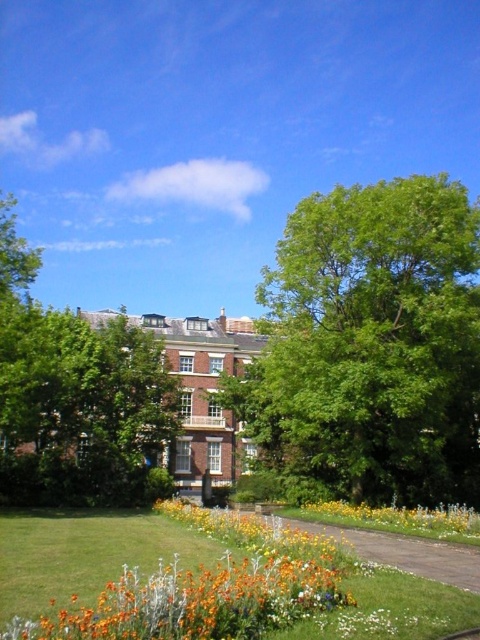
Question: Can you confirm if green leafy tree at center is positioned to the left of yellow matte flower at lower center?

Choices:
 (A) no
 (B) yes

Answer: (B)

Question: Which object is closer to the camera taking this photo?

Choices:
 (A) green leafy tree at center
 (B) yellow matte flower at lower center

Answer: (B)

Question: Is green leafy tree at center further to the viewer compared to yellow matte flower at lower center?

Choices:
 (A) no
 (B) yes

Answer: (B)

Question: Which point is closer to the camera?

Choices:
 (A) (471, 436)
 (B) (343, 504)

Answer: (B)

Question: Is green leafy tree at center positioned behind green leafy tree at upper center?

Choices:
 (A) no
 (B) yes

Answer: (A)

Question: Which point is closer to the camera?

Choices:
 (A) green leafy tree at upper center
 (B) green leafy tree at center

Answer: (B)